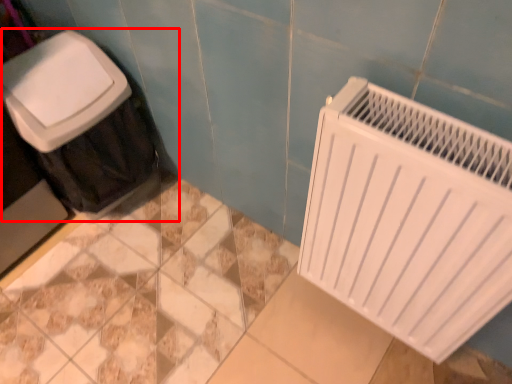
Question: In this image, where is waste container (annotated by the red box) located relative to radiator?

Choices:
 (A) right
 (B) left

Answer: (B)